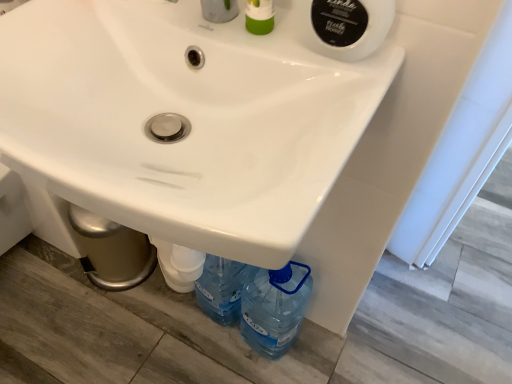
Question: In which direction should I rotate to look at green plastic soap dispenser at upper center?

Choices:
 (A) left
 (B) right

Answer: (B)

Question: Would you say green plastic soap dispenser at upper center is outside white plastic pipe at lower center?

Choices:
 (A) yes
 (B) no

Answer: (A)

Question: Does green plastic soap dispenser at upper center have a lesser height compared to white plastic pipe at lower center?

Choices:
 (A) no
 (B) yes

Answer: (A)

Question: Considering the relative sizes of green plastic soap dispenser at upper center and white plastic pipe at lower center in the image provided, is green plastic soap dispenser at upper center wider than white plastic pipe at lower center?

Choices:
 (A) no
 (B) yes

Answer: (A)

Question: Is green plastic soap dispenser at upper center far away from white plastic pipe at lower center?

Choices:
 (A) yes
 (B) no

Answer: (B)

Question: From the image's perspective, would you say green plastic soap dispenser at upper center is shown under white plastic pipe at lower center?

Choices:
 (A) no
 (B) yes

Answer: (A)

Question: Does green plastic soap dispenser at upper center appear on the left side of white plastic pipe at lower center?

Choices:
 (A) no
 (B) yes

Answer: (A)

Question: From a real-world perspective, is white plastic pipe at lower center physically above white glossy sink at center?

Choices:
 (A) no
 (B) yes

Answer: (A)

Question: Does white plastic pipe at lower center have a greater width compared to white glossy sink at center?

Choices:
 (A) no
 (B) yes

Answer: (A)

Question: Is white plastic pipe at lower center outside white glossy sink at center?

Choices:
 (A) yes
 (B) no

Answer: (A)

Question: From the image's perspective, is white plastic pipe at lower center located beneath white glossy sink at center?

Choices:
 (A) no
 (B) yes

Answer: (B)

Question: Considering the relative positions of white plastic pipe at lower center and white glossy sink at center in the image provided, is white plastic pipe at lower center to the left of white glossy sink at center from the viewer's perspective?

Choices:
 (A) no
 (B) yes

Answer: (B)

Question: Are white plastic pipe at lower center and white glossy sink at center far apart?

Choices:
 (A) no
 (B) yes

Answer: (A)

Question: Can you confirm if white glossy sink at center is smaller than green plastic soap dispenser at upper center?

Choices:
 (A) no
 (B) yes

Answer: (A)